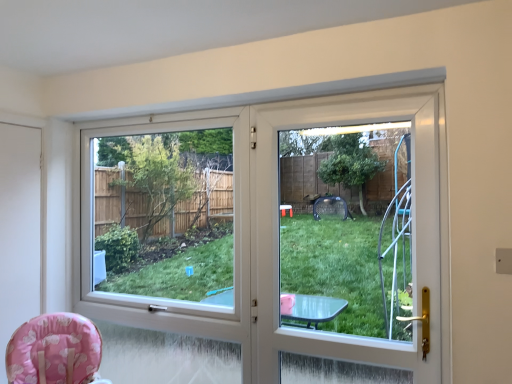
The height and width of the screenshot is (384, 512). Identify the location of free spot above white plastic screen door at center, placed as the first screen door when sorted from front to back (from a real-world perspective). (352, 98).